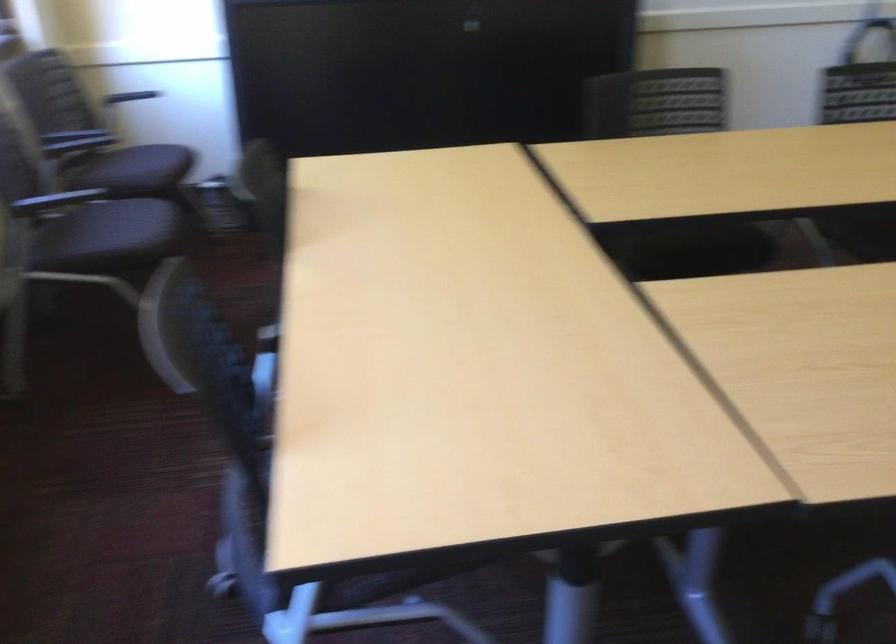
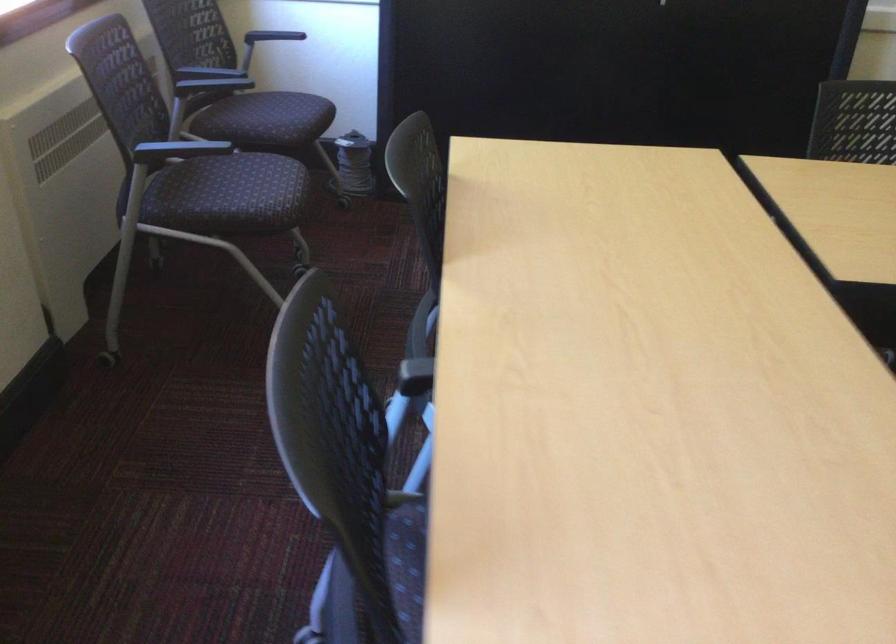
The point at (124, 100) is marked in the first image. Where is the corresponding point in the second image?

(270, 38)